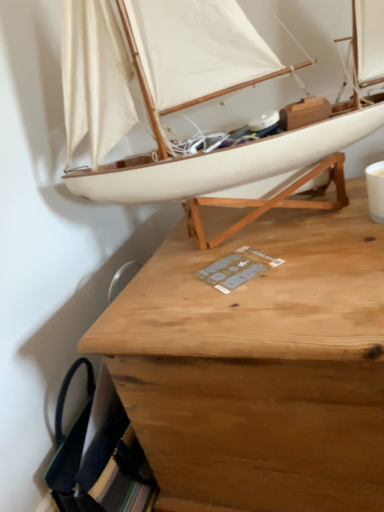
The image size is (384, 512). I want to click on vacant area that is in front of white matte sailboat at upper center, so click(x=250, y=296).